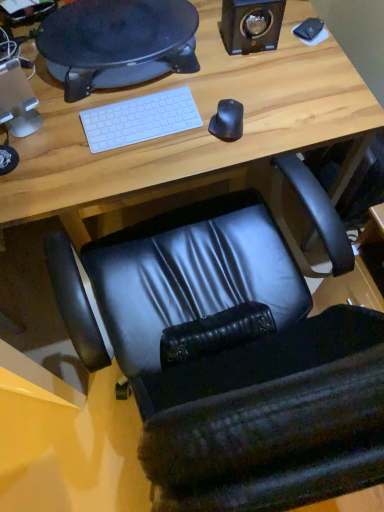
Where is `free space to the left of white matte keyboard at center`? The height and width of the screenshot is (512, 384). free space to the left of white matte keyboard at center is located at coordinates (61, 129).